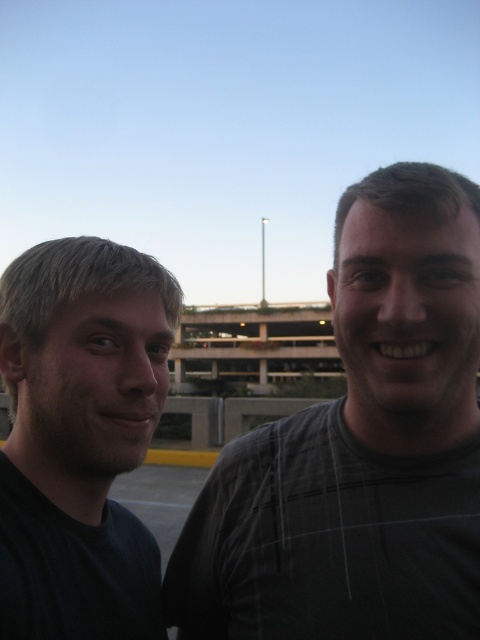
Where is `dark gray plaid shirt at right`? The image size is (480, 640). dark gray plaid shirt at right is located at coordinates (360, 448).

At what (x,y) coordinates should I click in order to perform the action: click on dark gray plaid shirt at right. Please return your answer as a coordinate pair (x, y). The width and height of the screenshot is (480, 640). Looking at the image, I should click on (360, 448).

Find the location of a particular element. This screenshot has height=640, width=480. dark gray plaid shirt at right is located at coordinates (360, 448).